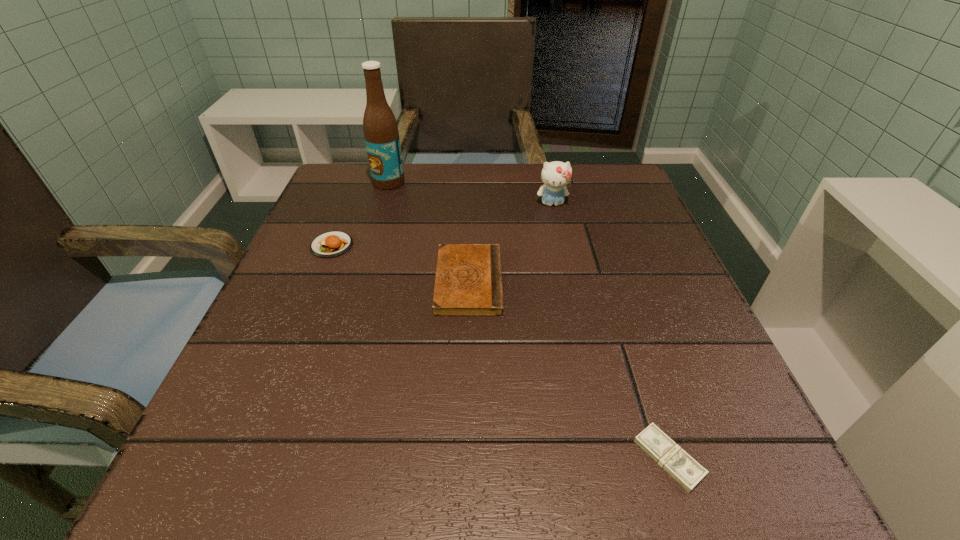
Locate an element on the screen. This screenshot has height=540, width=960. object that is at the far left corner is located at coordinates (380, 128).

Find the location of a particular element. The height and width of the screenshot is (540, 960). object located in the near right corner section of the desktop is located at coordinates (663, 450).

In the image, there is a desktop. Identify the location of vacant space at the far edge. (524, 197).

Find the location of a particular element. This screenshot has width=960, height=540. blank space at the near edge of the desktop is located at coordinates (391, 459).

In the image, there is a desktop. Identify the location of vacant space at the left edge. The width and height of the screenshot is (960, 540). (337, 339).

In the image, there is a desktop. Where is `vacant space at the right edge`? Image resolution: width=960 pixels, height=540 pixels. vacant space at the right edge is located at coordinates (x=608, y=309).

I want to click on free space at the far left corner of the desktop, so click(354, 168).

Find the location of `vacant space at the far right corner of the desktop`. vacant space at the far right corner of the desktop is located at coordinates (572, 195).

The height and width of the screenshot is (540, 960). Find the location of `vacant space that is in between the tallest object and the second shortest object`. vacant space that is in between the tallest object and the second shortest object is located at coordinates click(x=429, y=232).

You are a GUI agent. You are given a task and a screenshot of the screen. Output one action in this format:
    pyautogui.click(x=<x>, y=<y>)
    Task: Click on the empty location between the tallest object and the third shortest object
    
    Given the screenshot: What is the action you would take?
    pyautogui.click(x=360, y=214)